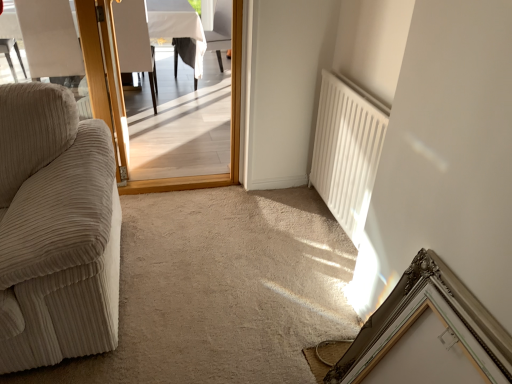
What do you see at coordinates (104, 76) in the screenshot? The image size is (512, 384). I see `wooden door at center` at bounding box center [104, 76].

Image resolution: width=512 pixels, height=384 pixels. What are the coordinates of `white fabric chair at upper center` in the screenshot? It's located at (220, 30).

Locate an element on the screen. The height and width of the screenshot is (384, 512). white matte radiator at right is located at coordinates (346, 151).

What is the approximate height of wooden screen door at left?

The height of wooden screen door at left is 3.65 feet.

I want to click on beige corduroy armchair at left, positioned as the 1th armchair in left-to-right order, so pyautogui.click(x=51, y=41).

What do you see at coordinates (134, 42) in the screenshot? Image resolution: width=512 pixels, height=384 pixels. I see `beige corduroy armchair at left, marked as the first armchair in a right-to-left arrangement` at bounding box center [134, 42].

The width and height of the screenshot is (512, 384). Find the location of `wooden door at center`. wooden door at center is located at coordinates (104, 76).

Is beige corduroy armchair at left, positioned as the 1th armchair in left-to-right order, to the left or to the right of beige corduroy armchair at left, marked as the first armchair in a right-to-left arrangement, in the image?

In the image, beige corduroy armchair at left, positioned as the 1th armchair in left-to-right order, appears on the left side of beige corduroy armchair at left, marked as the first armchair in a right-to-left arrangement.

From the image's perspective, which is above, beige corduroy armchair at left, positioned as the 1th armchair in left-to-right order, or beige corduroy armchair at left, arranged as the second armchair when viewed from the left?

beige corduroy armchair at left, arranged as the second armchair when viewed from the left.

Does point (57, 76) come farther from viewer compared to point (155, 84)?

That is True.

Is beige corduroy armchair at left, positioned as the 1th armchair in left-to-right order, in contact with wooden door at center?

No, beige corduroy armchair at left, positioned as the 1th armchair in left-to-right order, is not with wooden door at center.

In terms of width, does beige corduroy armchair at left, marked as the 2th armchair in a right-to-left arrangement, look wider or thinner when compared to wooden door at center?

beige corduroy armchair at left, marked as the 2th armchair in a right-to-left arrangement, is wider than wooden door at center.

From the picture: Which point is more distant from viewer, (39, 9) or (119, 136)?

The point (39, 9) is more distant.

You are a GUI agent. You are given a task and a screenshot of the screen. Output one action in this format:
    pyautogui.click(x=<x>, y=<y>)
    Task: Click on the chair to the right of beige corduroy armchair at left, positioned as the 1th armchair in left-to-right order
    Image resolution: width=512 pixels, height=384 pixels.
    Given the screenshot: What is the action you would take?
    220,30

Which of these two, beige corduroy armchair at left, marked as the 2th armchair in a right-to-left arrangement, or white fabric chair at upper center, is thinner?

With smaller width is beige corduroy armchair at left, marked as the 2th armchair in a right-to-left arrangement.

From the picture: Is beige corduroy armchair at left, marked as the 2th armchair in a right-to-left arrangement, with white fabric chair at upper center?

No, beige corduroy armchair at left, marked as the 2th armchair in a right-to-left arrangement, is not making contact with white fabric chair at upper center.

Is wooden screen door at left inside the boundaries of wooden door at center, or outside?

wooden screen door at left lies outside wooden door at center.

From a real-world perspective, is wooden screen door at left on wooden door at center?

Yes, from a real-world perspective, wooden screen door at left is above wooden door at center.

From the image's perspective, would you say wooden screen door at left is positioned over wooden door at center?

No.

Is wooden screen door at left next to wooden door at center?

wooden screen door at left and wooden door at center are clearly separated.

How much distance is there between silver ornate picture frame at lower right and wooden screen door at left?

silver ornate picture frame at lower right and wooden screen door at left are 1.57 meters apart.

From a real-world perspective, is silver ornate picture frame at lower right positioned above or below wooden screen door at left?

Clearly, from a real-world perspective, silver ornate picture frame at lower right is below wooden screen door at left.

Is silver ornate picture frame at lower right aimed at wooden screen door at left?

No, silver ornate picture frame at lower right is not facing towards wooden screen door at left.

Is wooden screen door at left positioned with its back to white fabric chair at upper center?

Yes, wooden screen door at left is positioned with its back facing white fabric chair at upper center.

From the image's perspective, relative to white fabric chair at upper center, is wooden screen door at left above or below?

wooden screen door at left is situated lower than white fabric chair at upper center in the image.

Are wooden screen door at left and white fabric chair at upper center making contact?

They are not placed beside each other.

From a real-world perspective, does wooden screen door at left stand above white fabric chair at upper center?

Yes, from a real-world perspective, wooden screen door at left is over white fabric chair at upper center

Considering the sizes of wooden door at center and white matte radiator at right in the image, is wooden door at center wider or thinner than white matte radiator at right?

Clearly, wooden door at center has less width compared to white matte radiator at right.

Is wooden door at center looking in the opposite direction of white matte radiator at right?

wooden door at center does not have its back to white matte radiator at right.

In the image, is wooden door at center positioned in front of or behind white matte radiator at right?

Visually, wooden door at center is located behind white matte radiator at right.

Where is `armchair on the right of beige corduroy armchair at left, marked as the 2th armchair in a right-to-left arrangement`? armchair on the right of beige corduroy armchair at left, marked as the 2th armchair in a right-to-left arrangement is located at coordinates (134, 42).

This screenshot has height=384, width=512. I want to click on door below the beige corduroy armchair at left, marked as the 2th armchair in a right-to-left arrangement (from the image's perspective), so click(x=104, y=76).

In the scene shown: When comparing their distances from white matte radiator at right, does wooden screen door at left or white fabric chair at upper center seem further?

Based on the image, white fabric chair at upper center appears to be further to white matte radiator at right.

Looking at the image, which one is located closer to white fabric chair at upper center, wooden screen door at left or wooden door at center?

wooden door at center is positioned closer to the anchor white fabric chair at upper center.

When comparing their distances from silver ornate picture frame at lower right, does wooden screen door at left or wooden door at center seem further?

The object further to silver ornate picture frame at lower right is wooden door at center.

Looking at the image, which one is located closer to beige corduroy armchair at left, marked as the first armchair in a right-to-left arrangement, wooden screen door at left or beige corduroy armchair at left, marked as the 2th armchair in a right-to-left arrangement?

Based on the image, beige corduroy armchair at left, marked as the 2th armchair in a right-to-left arrangement, appears to be nearer to beige corduroy armchair at left, marked as the first armchair in a right-to-left arrangement.

From the picture: Looking at the image, which one is located closer to beige corduroy armchair at left, marked as the first armchair in a right-to-left arrangement, beige corduroy armchair at left, marked as the 2th armchair in a right-to-left arrangement, or silver ornate picture frame at lower right?

The object closer to beige corduroy armchair at left, marked as the first armchair in a right-to-left arrangement, is beige corduroy armchair at left, marked as the 2th armchair in a right-to-left arrangement.

Which object lies nearer to the anchor point wooden screen door at left, beige corduroy armchair at left, positioned as the 1th armchair in left-to-right order, or silver ornate picture frame at lower right?

The object closer to wooden screen door at left is beige corduroy armchair at left, positioned as the 1th armchair in left-to-right order.

Based on their spatial positions, is white fabric chair at upper center or white matte radiator at right closer to beige corduroy armchair at left, marked as the 2th armchair in a right-to-left arrangement?

Based on the image, white fabric chair at upper center appears to be nearer to beige corduroy armchair at left, marked as the 2th armchair in a right-to-left arrangement.

Which object lies further to the anchor point white matte radiator at right, silver ornate picture frame at lower right or beige corduroy armchair at left, arranged as the second armchair when viewed from the left?

Among the two, beige corduroy armchair at left, arranged as the second armchair when viewed from the left, is located further to white matte radiator at right.

I want to click on door between silver ornate picture frame at lower right and beige corduroy armchair at left, marked as the first armchair in a right-to-left arrangement, along the z-axis, so click(104, 76).

Locate an element on the screen. The width and height of the screenshot is (512, 384). screen door between silver ornate picture frame at lower right and white fabric chair at upper center along the z-axis is located at coordinates (231, 132).

Where is `armchair located between beige corduroy armchair at left, marked as the 2th armchair in a right-to-left arrangement, and white matte radiator at right in the left-right direction`? The image size is (512, 384). armchair located between beige corduroy armchair at left, marked as the 2th armchair in a right-to-left arrangement, and white matte radiator at right in the left-right direction is located at coordinates (134, 42).

Find the location of `picture frame situated between wooden screen door at left and white matte radiator at right from left to right`. picture frame situated between wooden screen door at left and white matte radiator at right from left to right is located at coordinates (419, 315).